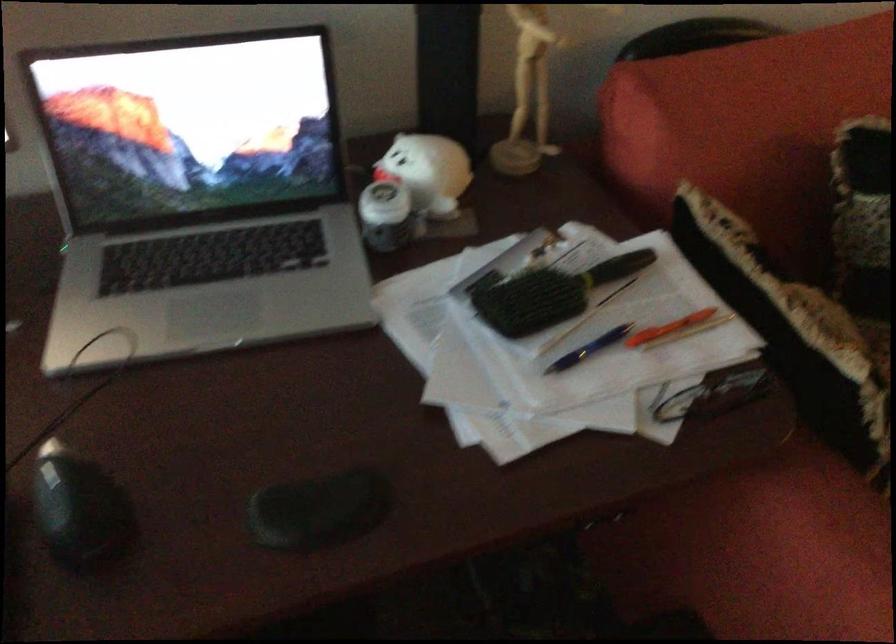
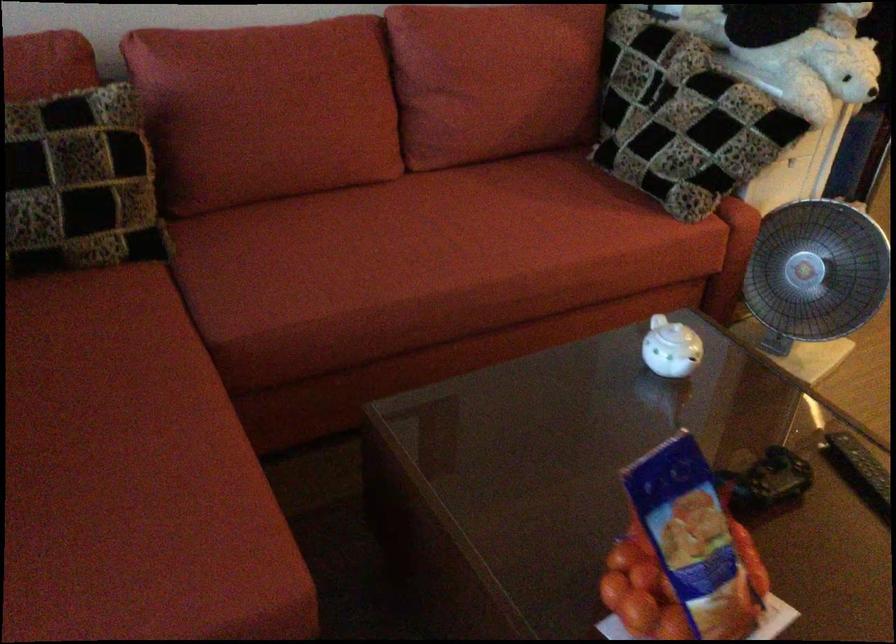
Question: Which direction would the cameraman need to move to produce the second image? Reply with the corresponding letter.

Choices:
 (A) Left
 (B) Right
 (C) Forward
 (D) Backward

Answer: (B)